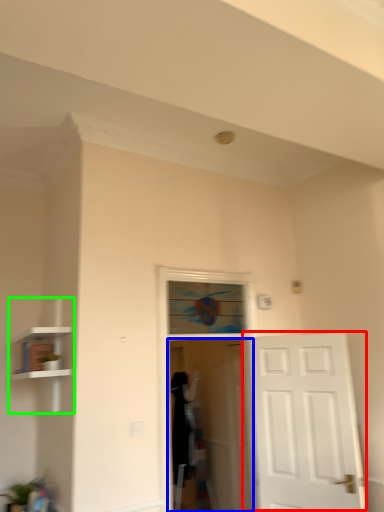
Question: Based on their relative distances, which object is nearer to door (highlighted by a red box)? Choose from screen door (highlighted by a blue box) and bookshelf (highlighted by a green box).

Choices:
 (A) screen door
 (B) bookshelf

Answer: (A)